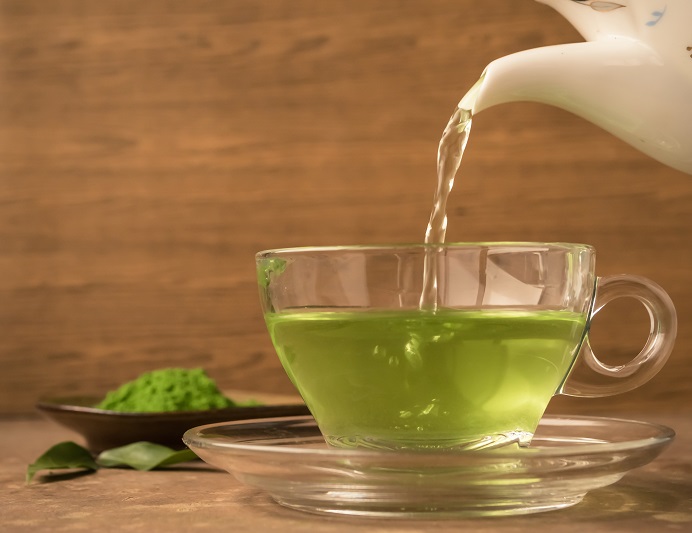
Image resolution: width=692 pixels, height=533 pixels. In order to click on glass tea cup in this screenshot , I will do `click(410, 387)`.